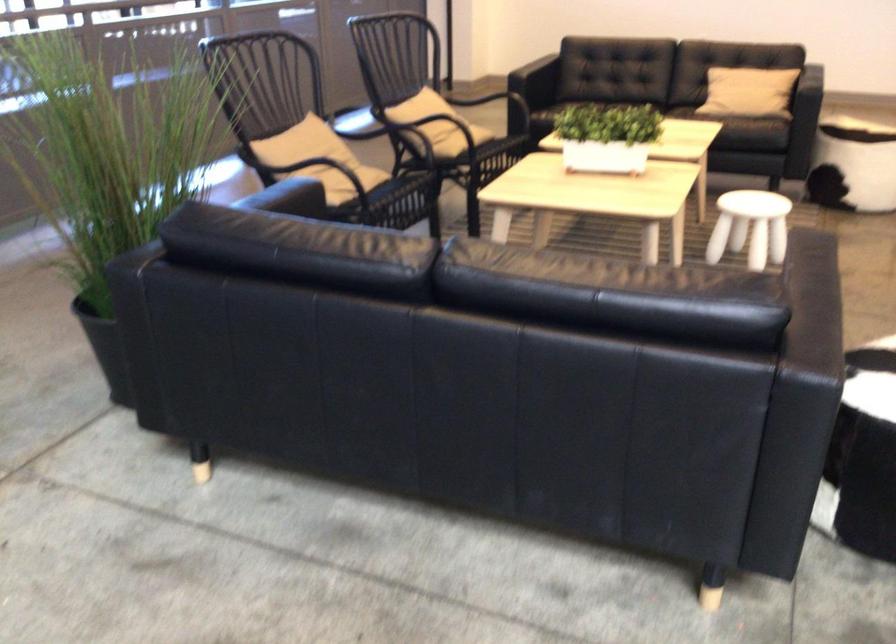
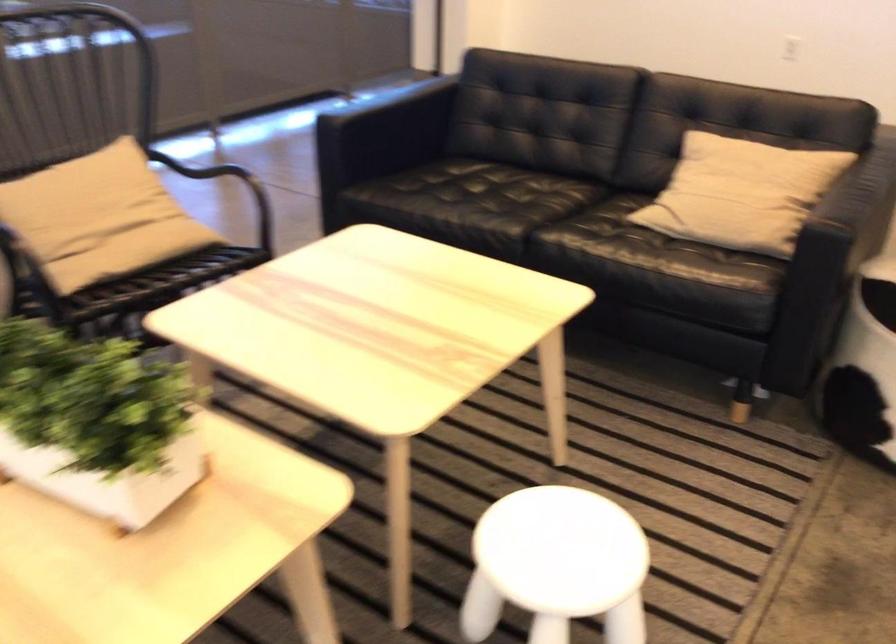
In the second image, find the point that corresponds to [788,78] in the first image.

(741, 193)